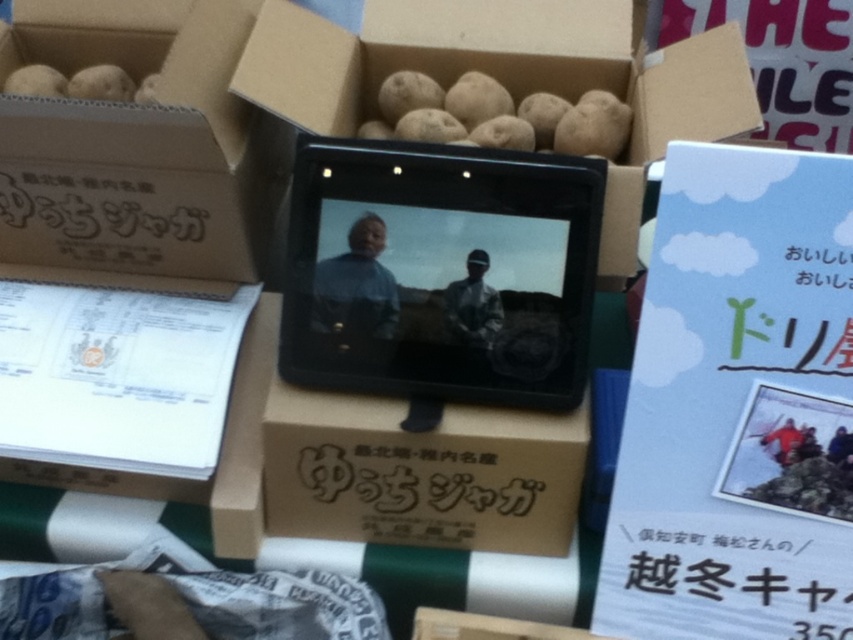
Where is `matte cardboard box at center`? The width and height of the screenshot is (853, 640). matte cardboard box at center is located at coordinates (506, 76).

Can you confirm if matte cardboard box at center is positioned to the right of brown matte potatoes at upper center?

Indeed, matte cardboard box at center is positioned on the right side of brown matte potatoes at upper center.

Which is behind, point (543, 52) or point (398, 96)?

Point (543, 52)

The image size is (853, 640). Find the location of `matte cardboard box at center`. matte cardboard box at center is located at coordinates (506, 76).

Does brown matte potatoes at upper center appear under smooth brown potatoes at upper left?

Indeed, brown matte potatoes at upper center is positioned under smooth brown potatoes at upper left.

Is point (573, 129) behind point (90, 84)?

No.

This screenshot has height=640, width=853. I want to click on brown matte potatoes at upper center, so click(497, 115).

Is matte cardboard box at center thinner than smooth brown potatoes at upper left?

Incorrect, matte cardboard box at center's width is not less than smooth brown potatoes at upper left's.

This screenshot has height=640, width=853. What do you see at coordinates (506, 76) in the screenshot?
I see `matte cardboard box at center` at bounding box center [506, 76].

Locate an element on the screen. The width and height of the screenshot is (853, 640). matte cardboard box at center is located at coordinates (506, 76).